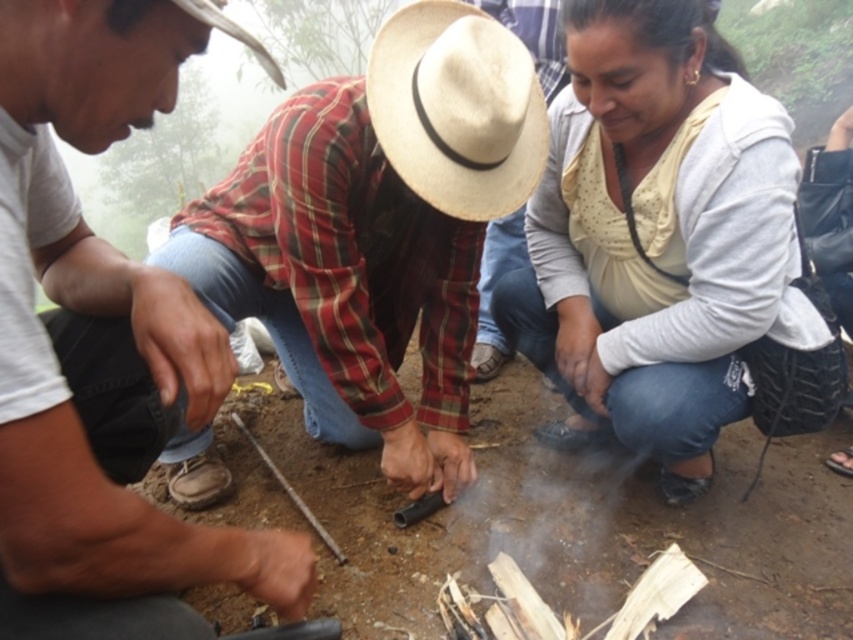
Can you confirm if white textured sweater at center is taller than woven straw hat at center?

Yes.

Is point (634, 280) less distant than point (426, 134)?

No, it is not.

Which is behind, point (596, 198) or point (463, 144)?

Positioned behind is point (596, 198).

Where is `white textured sweater at center`? Image resolution: width=853 pixels, height=640 pixels. white textured sweater at center is located at coordinates (660, 243).

Which is behind, point (196, 349) or point (587, 298)?

Positioned behind is point (587, 298).

Is plaid fabric shirt at center further to the viewer compared to white textured sweater at center?

No, it is not.

Is point (61, 576) farther from viewer compared to point (641, 438)?

That is False.

Locate an element on the screen. plaid fabric shirt at center is located at coordinates (102, 349).

Does plaid fabric shirt at center lie in front of woven straw hat at center?

Yes.

Does point (225, 387) lie behind point (492, 60)?

That is False.

Where is `plaid fabric shirt at center`? Image resolution: width=853 pixels, height=640 pixels. plaid fabric shirt at center is located at coordinates (102, 349).